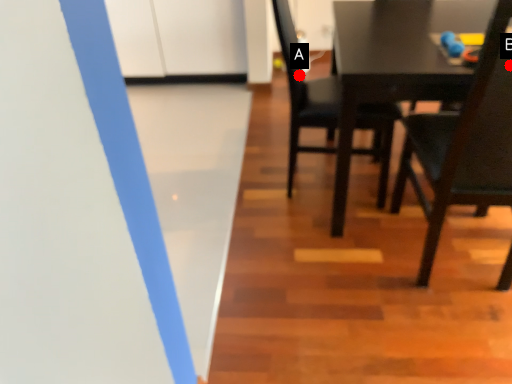
Question: Two points are circled on the image, labeled by A and B beside each circle. Which point is further to the camera?

Choices:
 (A) A is further
 (B) B is further

Answer: (A)